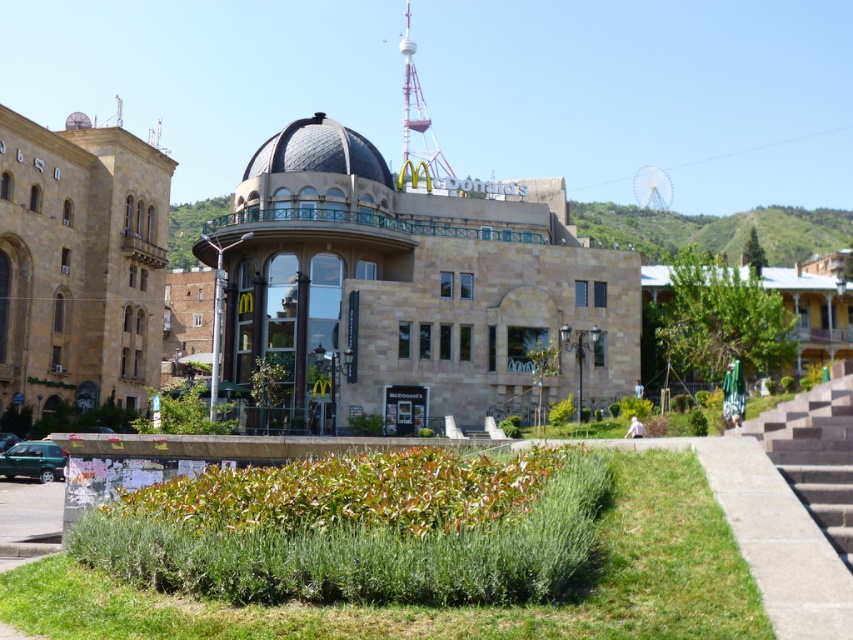
You are standing at the entrance of the McDonalds restaurant and want to take a photo of both the point at coordinates point (x=845, y=368) and point (x=292, y=170). Which point should you focus on first to ensure both are in the frame?

You should focus on point (x=845, y=368) first because it is closer to you than point (x=292, y=170), ensuring both points are within the camera frame.

You are a delivery person carrying a heavy box and need to reach the shiny metallic dome at center. The concrete stairs at right are in your path. Considering their height, will the stairs be a challenge for you to climb?

The concrete stairs at right has a lesser height compared to shiny metallic dome at center, so the stairs are shorter than the dome. Since the stairs are lower, they should not pose a significant challenge for climbing to reach the shiny metallic dome at center.